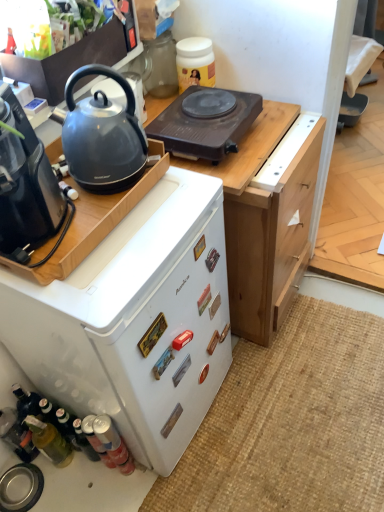
At what (x,y) coordinates should I click in order to perform the action: click on vacant area that lies to the right of black plastic coffee maker at left. Please return your answer as a coordinate pair (x, y). The image size is (384, 512). Looking at the image, I should click on (140, 240).